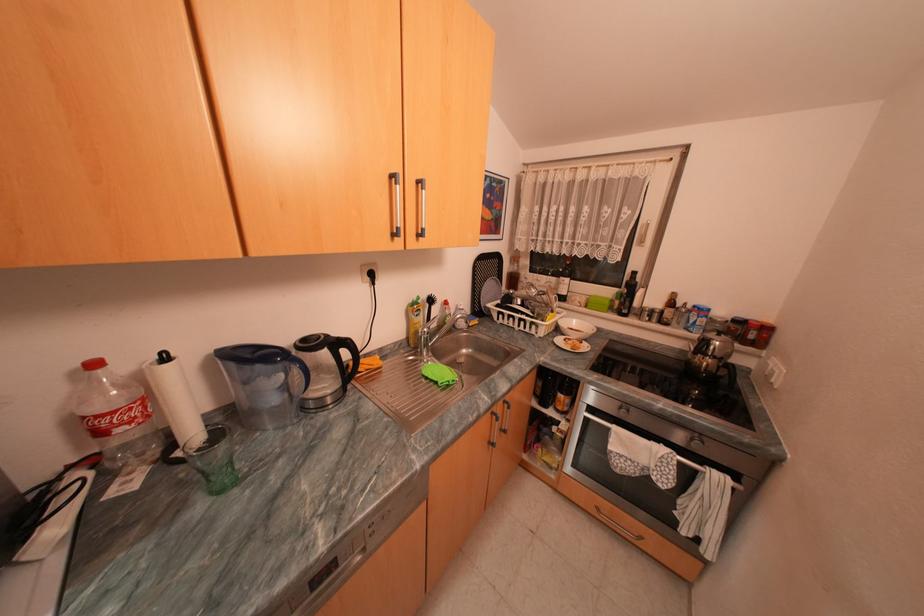
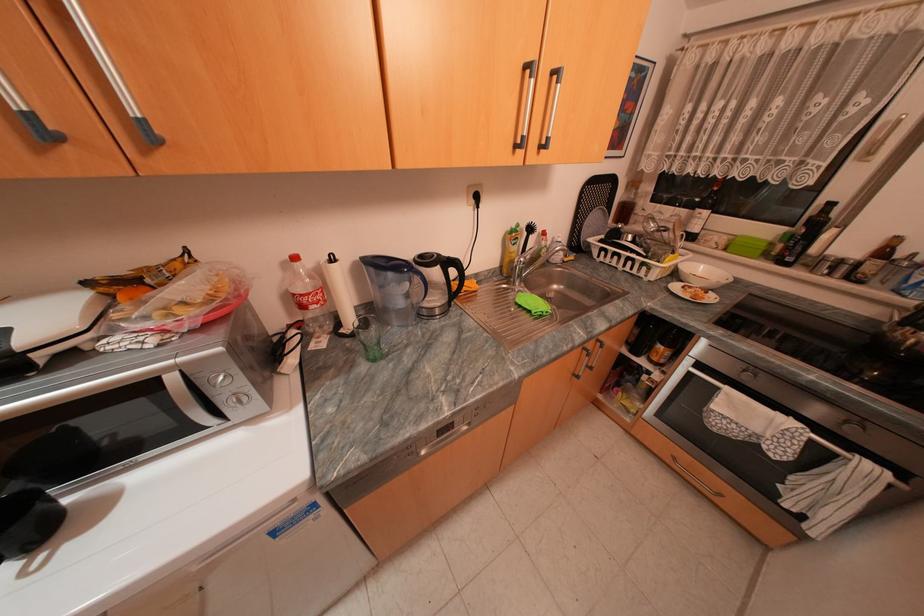
The point at (x=701, y=438) is marked in the first image. Where is the corresponding point in the second image?

(857, 421)